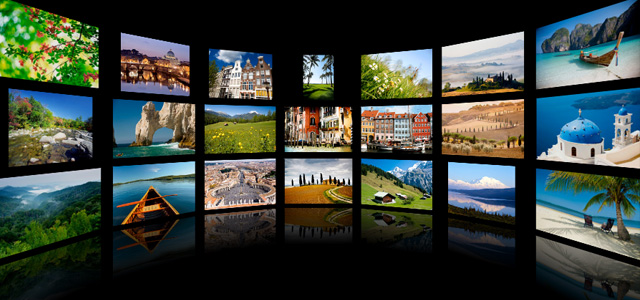
Where is `bottom row of tv screen`? Image resolution: width=640 pixels, height=300 pixels. bottom row of tv screen is located at coordinates (76, 212), (162, 197), (244, 180), (317, 176), (387, 180), (481, 189), (596, 222).